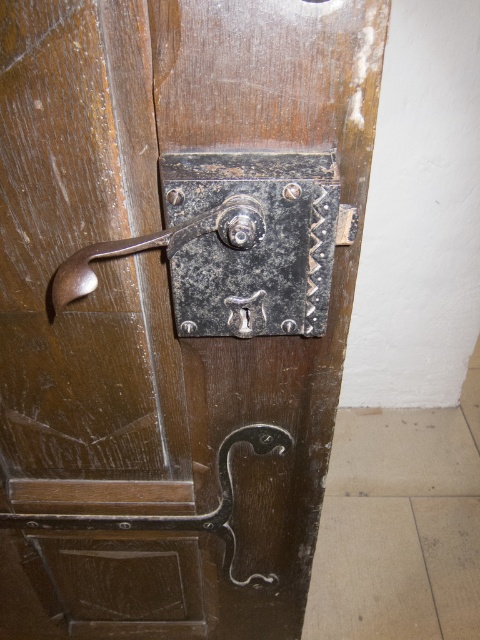
You are trying to open the door and need to reach both the polished dark brown metal hook at lower center and the polished brass lever at center. Which one should you touch first to open the door?

You should touch the polished dark brown metal hook at lower center first because it is closer to you than the polished brass lever at center.

You are a locksmith examining the door and need to replace the lock. You notice the polished dark brown metal hook at lower center and the polished brass lever at center. Which object is located to the right of the other?

The polished dark brown metal hook at lower center is positioned on the right side of the polished brass lever at center.